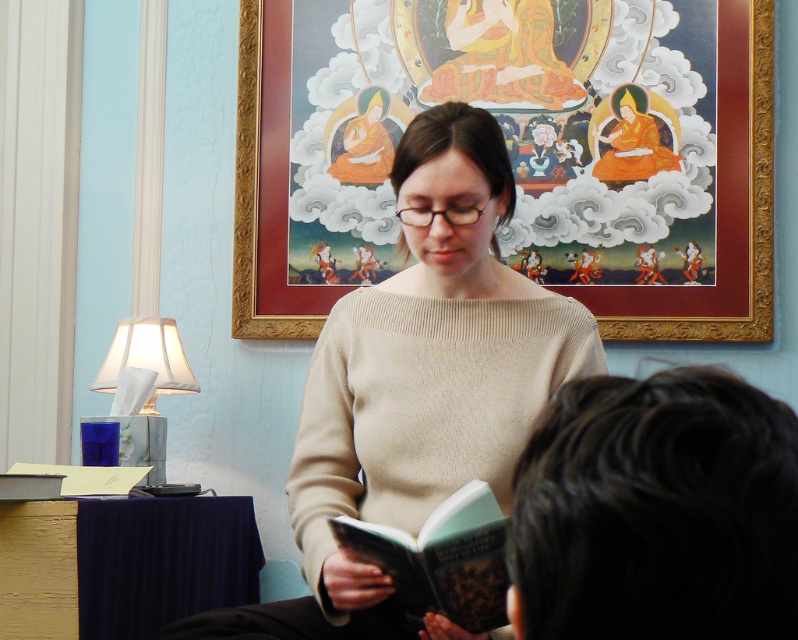
Consider the image. You are standing in the room depicted in the scene and want to place a small plant on the floor. The plant requires a spot that is at least 6 feet away from the viewer to avoid blocking the artwork. Is the point at coordinates point (378, 552) suitable for placing the plant?

The distance of point (378, 552) from the viewer is 5.95 feet, which is slightly less than the required 6 feet. Therefore, placing the plant at this point may block the artwork and is not suitable.

You are standing in the room and want to place a new book exactly where the hardcover book at center is located. What are the coordinates where you should place the new book?

The coordinates for placing the new book should be at point (x=441, y=557), as that is where the hardcover book at center is located.